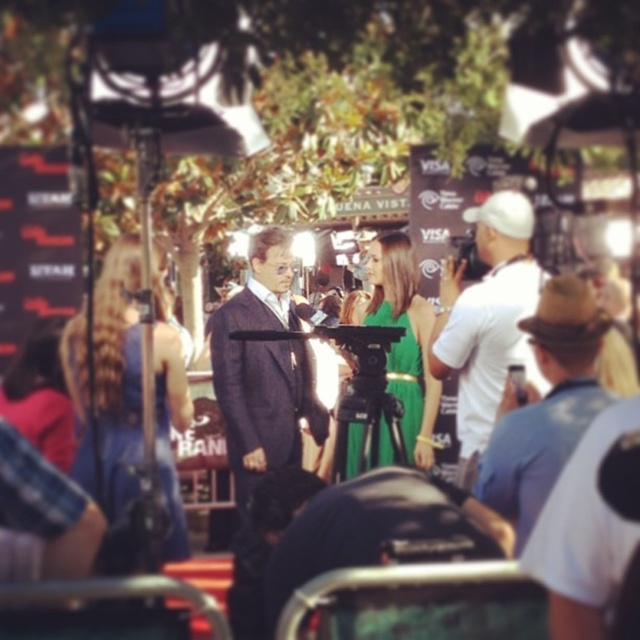
You are a photographer at the event and need to capture a photo that includes both the textured navy suit at center and the white cotton shirt at right. Based on their positions, where should you position your camera to ensure both are in frame?

To include both the textured navy suit at center and the white cotton shirt at right in the photo, position the camera above the textured navy suit at center since it is located below the white cotton shirt at right, ensuring both are within the frame.

You are a photographer at the event and need to capture a clear shot of both the textured navy suit at center and the brown felt hat at upper right. Since you want both subjects to be visible in the frame, which object should you focus on first to ensure depth of field?

The textured navy suit at center is taller than the brown felt hat at upper right, so focusing on the textured navy suit at center first would ensure both are within the depth of field as it is closer in size and occupies more visual importance in the frame.

You are standing at the origin point of the image coordinate system. You want to move towards the textured navy suit at center. In which direction should you move?

The textured navy suit at center is located at coordinate point 0.580 on the x axis and 0.412 on the y axis. Since the origin point is at the bottom left corner of the image, moving towards the textured navy suit at center would require moving to the right and slightly upwards from the origin point.